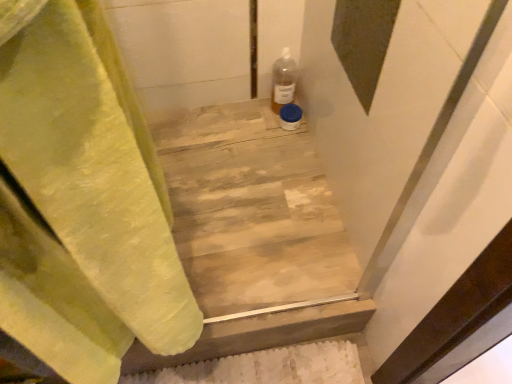
The height and width of the screenshot is (384, 512). What do you see at coordinates (283, 80) in the screenshot?
I see `translucent plastic bottle at upper right` at bounding box center [283, 80].

The width and height of the screenshot is (512, 384). Identify the location of translucent plastic bottle at upper right. (283, 80).

Locate an element on the screen. Image resolution: width=512 pixels, height=384 pixels. wooden at center is located at coordinates (254, 235).

Describe the element at coordinates (254, 235) in the screenshot. This screenshot has height=384, width=512. I see `wooden at center` at that location.

Where is `translucent plastic bottle at upper right`? Image resolution: width=512 pixels, height=384 pixels. translucent plastic bottle at upper right is located at coordinates (283, 80).

Considering the relative positions of translucent plastic bottle at upper right and wooden at center in the image provided, is translucent plastic bottle at upper right to the left or to the right of wooden at center?

Based on their positions, translucent plastic bottle at upper right is located to the right of wooden at center.

Is translucent plastic bottle at upper right in front of wooden at center?

No, it is behind wooden at center.

Which is behind, point (283, 65) or point (289, 300)?

Positioned behind is point (283, 65).

From the image's perspective, is translucent plastic bottle at upper right on wooden at center?

Yes.

From a real-world perspective, is translucent plastic bottle at upper right under wooden at center?

No, from a real-world perspective, translucent plastic bottle at upper right is not below wooden at center.

Considering the sizes of objects translucent plastic bottle at upper right and wooden at center in the image provided, who is wider, translucent plastic bottle at upper right or wooden at center?

wooden at center is wider.

Considering the relative sizes of translucent plastic bottle at upper right and wooden at center in the image provided, is translucent plastic bottle at upper right taller than wooden at center?

Yes, translucent plastic bottle at upper right is taller than wooden at center.

Does translucent plastic bottle at upper right have a larger size compared to wooden at center?

No, translucent plastic bottle at upper right is not bigger than wooden at center.

Is wooden at center inside translucent plastic bottle at upper right?

No, translucent plastic bottle at upper right does not contain wooden at center.

Is translucent plastic bottle at upper right positioned far away from wooden at center?

translucent plastic bottle at upper right is actually quite close to wooden at center.

Could you tell me if translucent plastic bottle at upper right is facing wooden at center?

No, translucent plastic bottle at upper right is not turned towards wooden at center.

Consider the image. What's the angular difference between translucent plastic bottle at upper right and wooden at center's facing directions?

0.183 degrees.

Identify the location of stairwell that appears on the left of translucent plastic bottle at upper right. (254, 235).

Can you confirm if wooden at center is positioned to the right of translucent plastic bottle at upper right?

No, wooden at center is not to the right of translucent plastic bottle at upper right.

Which object is more forward, wooden at center or translucent plastic bottle at upper right?

wooden at center is closer to the camera.

Is point (298, 214) closer to camera compared to point (287, 69)?

Yes.

In the scene shown: From the image's perspective, relative to translucent plastic bottle at upper right, is wooden at center above or below?

wooden at center is situated lower than translucent plastic bottle at upper right in the image.

From a real-world perspective, does wooden at center stand above translucent plastic bottle at upper right?

No, from a real-world perspective, wooden at center is not above translucent plastic bottle at upper right.

In terms of width, does wooden at center look wider or thinner when compared to translucent plastic bottle at upper right?

Considering their sizes, wooden at center looks broader than translucent plastic bottle at upper right.

From their relative heights in the image, would you say wooden at center is taller or shorter than translucent plastic bottle at upper right?

In the image, wooden at center appears to be shorter than translucent plastic bottle at upper right.

Considering the relative sizes of wooden at center and translucent plastic bottle at upper right in the image provided, is wooden at center bigger than translucent plastic bottle at upper right?

Yes.

Is wooden at center inside or outside of translucent plastic bottle at upper right?

wooden at center cannot be found inside translucent plastic bottle at upper right.

Is there a large distance between wooden at center and translucent plastic bottle at upper right?

No, wooden at center is in close proximity to translucent plastic bottle at upper right.

Is wooden at center aimed at translucent plastic bottle at upper right?

No, wooden at center is not aimed at translucent plastic bottle at upper right.

Image resolution: width=512 pixels, height=384 pixels. What are the coordinates of `bottle above the wooden at center (from the image's perspective)` in the screenshot? It's located at (283, 80).

Image resolution: width=512 pixels, height=384 pixels. Identify the location of stairwell located on the left of translucent plastic bottle at upper right. (254, 235).

The width and height of the screenshot is (512, 384). I want to click on stairwell that appears below the translucent plastic bottle at upper right (from the image's perspective), so click(x=254, y=235).